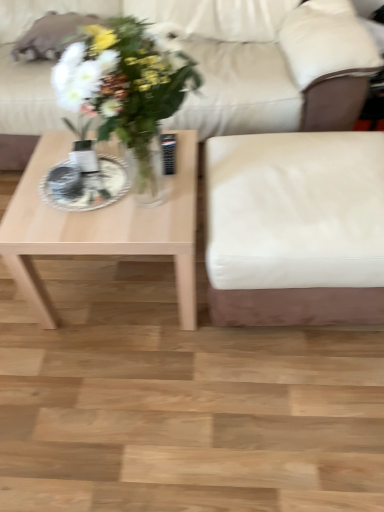
Locate an element on the screen. The width and height of the screenshot is (384, 512). free point above white leather armchair at right (from a real-world perspective) is located at coordinates (311, 172).